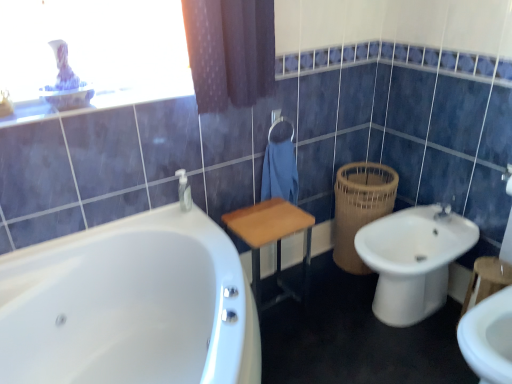
This screenshot has height=384, width=512. Find the location of `vacant space in front of white ceramic bidet at lower right`. vacant space in front of white ceramic bidet at lower right is located at coordinates (413, 356).